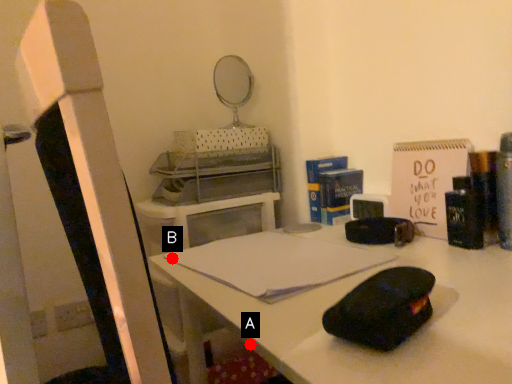
Question: Two points are circled on the image, labeled by A and B beside each circle. Which point is farther from the camera taking this photo?

Choices:
 (A) A is further
 (B) B is further

Answer: (A)